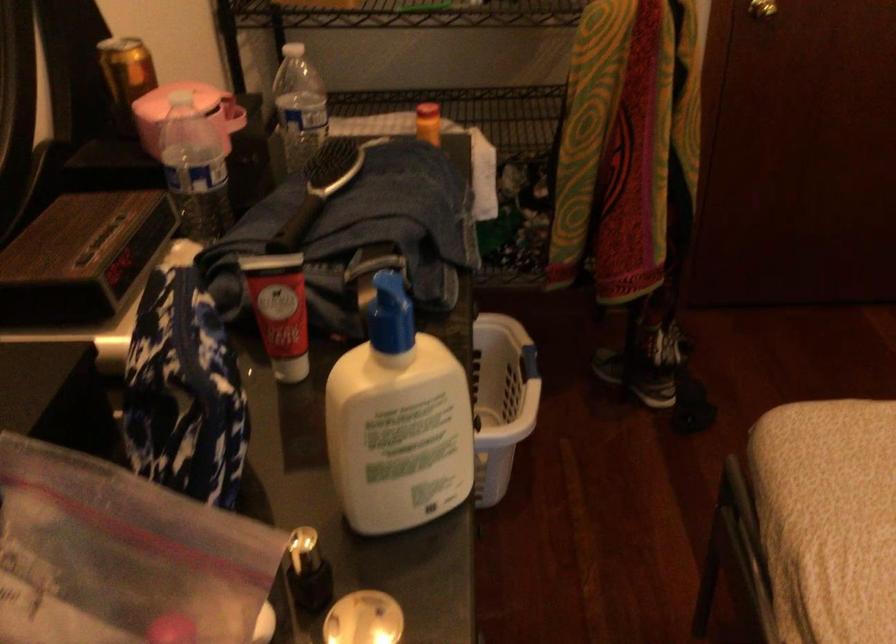
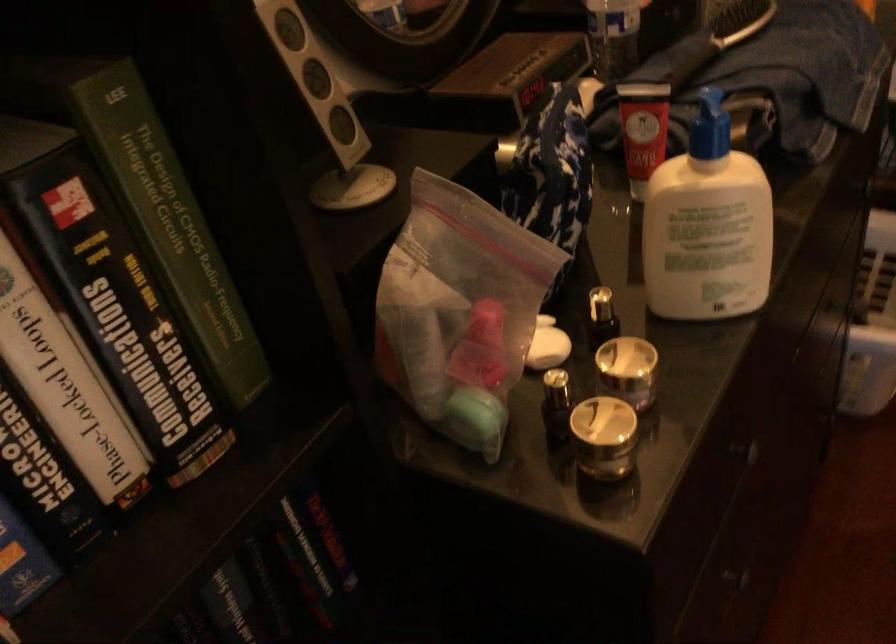
The point at (277, 308) is marked in the first image. Where is the corresponding point in the second image?

(642, 129)